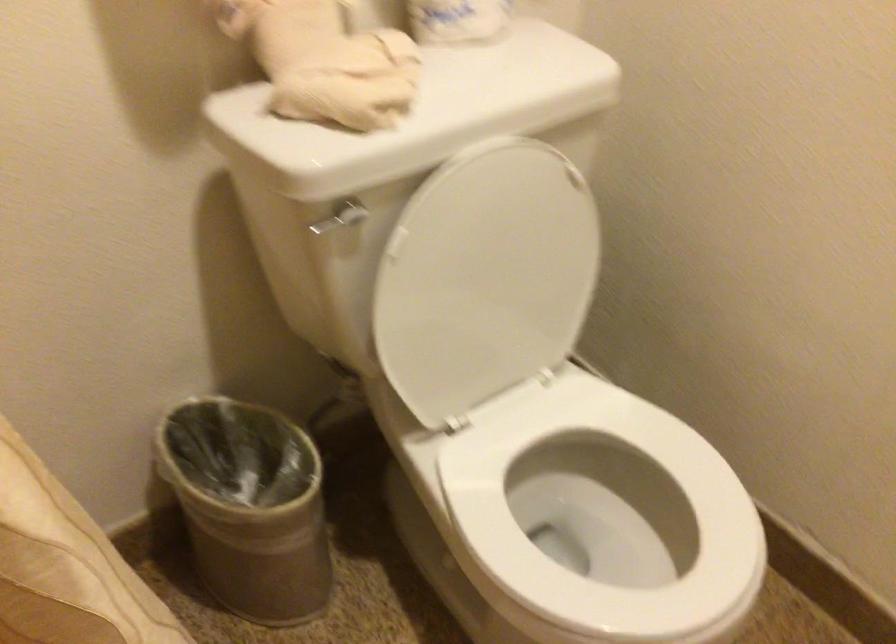
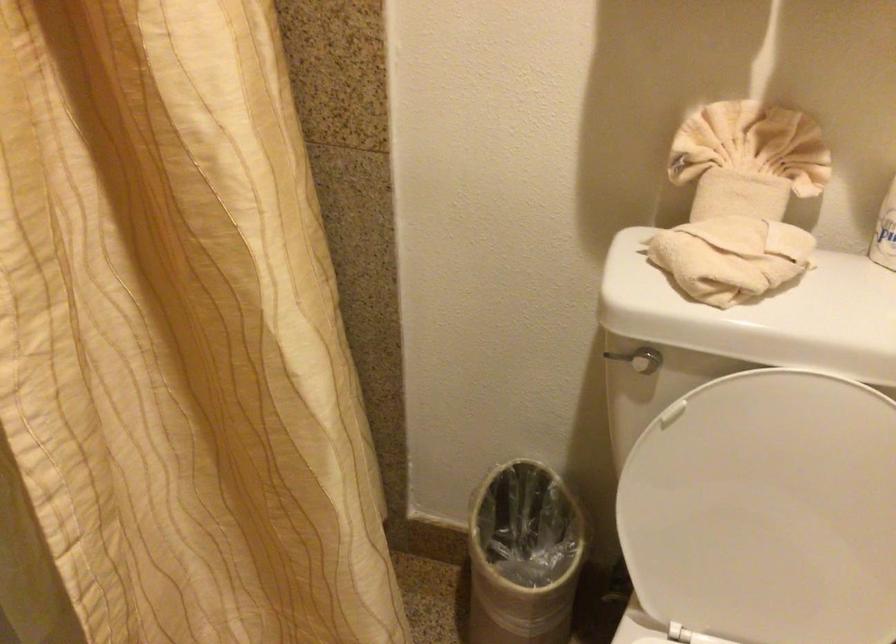
Locate, in the second image, the point that corresponds to point (485, 283) in the first image.

(767, 511)